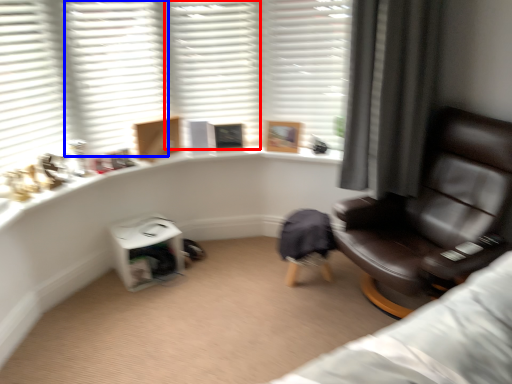
Question: Which of the following is the farthest to the observer, shutter (highlighted by a red box) or shutter (highlighted by a blue box)?

Choices:
 (A) shutter
 (B) shutter

Answer: (A)